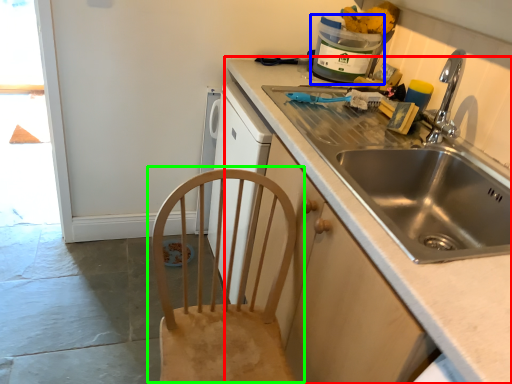
Question: Based on their relative distances, which object is nearer to countertop (highlighted by a red box)? Choose from appliance (highlighted by a blue box) and chair (highlighted by a green box).

Choices:
 (A) appliance
 (B) chair

Answer: (B)